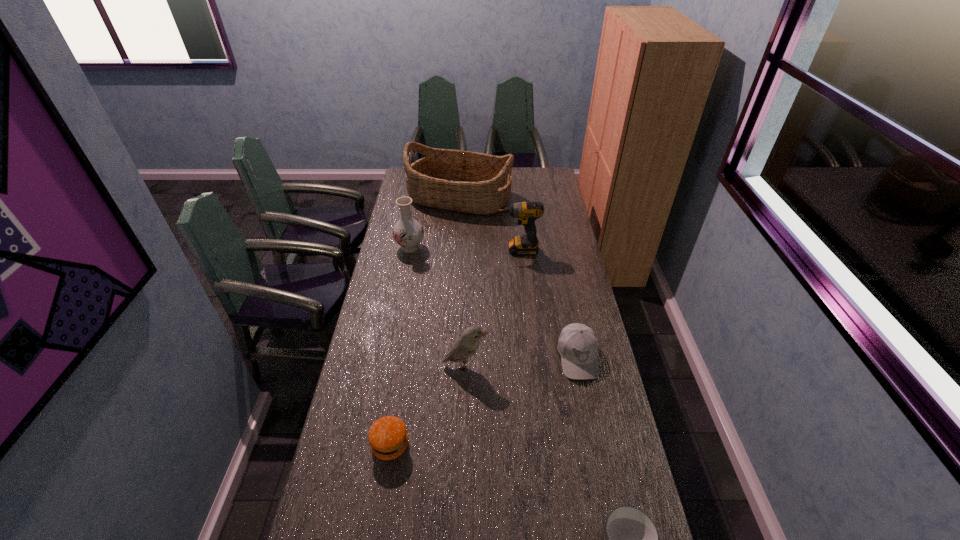
You are a GUI agent. You are given a task and a screenshot of the screen. Output one action in this format:
    pyautogui.click(x=<x>, y=<y>)
    Task: Click on the object that is at the far left corner
    The image size is (960, 540).
    Given the screenshot: What is the action you would take?
    pyautogui.click(x=471, y=182)

The height and width of the screenshot is (540, 960). Identify the location of vacant space at the left edge of the desktop. [330, 510].

The width and height of the screenshot is (960, 540). I want to click on vacant region at the right edge of the desktop, so click(x=579, y=390).

Locate an element on the screen. vacant space at the far left corner of the desktop is located at coordinates (406, 178).

The height and width of the screenshot is (540, 960). I want to click on free space between the bird and the farthest object, so click(462, 281).

Find the location of a particular element. The image size is (960, 540). free spot between the vase and the drill is located at coordinates (464, 248).

The height and width of the screenshot is (540, 960). I want to click on the fourth closest object relative to the vase, so click(x=578, y=345).

You are a GUI agent. You are given a task and a screenshot of the screen. Output one action in this format:
    pyautogui.click(x=<x>, y=<y>)
    Task: Click on the object that stands as the closest to the baseball cap
    The width and height of the screenshot is (960, 540).
    Given the screenshot: What is the action you would take?
    pyautogui.click(x=466, y=346)